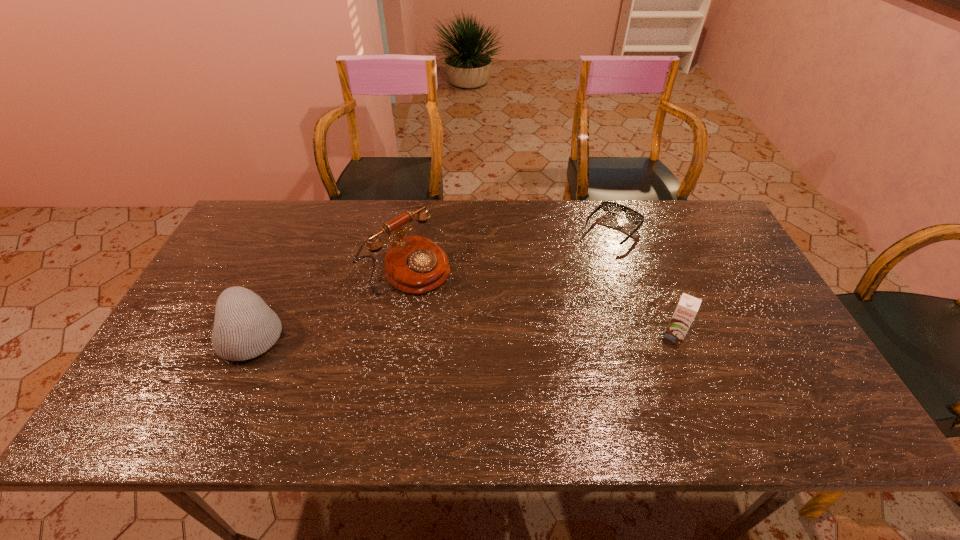
Locate an element on the screen. Image resolution: width=960 pixels, height=540 pixels. free region at the left edge is located at coordinates (195, 321).

This screenshot has height=540, width=960. I want to click on free location at the far right corner, so click(665, 201).

Where is `empty space that is in between the shortest object and the telephone`? The image size is (960, 540). empty space that is in between the shortest object and the telephone is located at coordinates (510, 249).

The height and width of the screenshot is (540, 960). Identify the location of blank region between the telephone and the leftmost object. (330, 301).

Find the location of a particular element. The image size is (960, 540). free space between the chocolate milk and the leftmost object is located at coordinates (464, 335).

The image size is (960, 540). I want to click on free space between the tallest object and the chocolate milk, so click(540, 302).

What are the coordinates of `vacant space that's between the beanie and the telephone` in the screenshot? It's located at (330, 301).

Locate an element on the screen. The height and width of the screenshot is (540, 960). vacant area that lies between the sunglasses and the telephone is located at coordinates (510, 249).

Identify the location of free spot between the chocolate milk and the beanie. The image size is (960, 540). (464, 335).

At what (x,y) coordinates should I click in order to perform the action: click on object that is the second closest to the shortest object. Please return your answer as a coordinate pair (x, y). The width and height of the screenshot is (960, 540). Looking at the image, I should click on (413, 264).